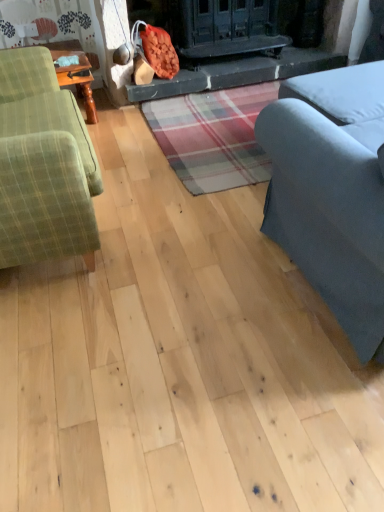
Find the location of a particular element. Image resolution: width=384 pixels, height=512 pixels. green plaid fabric couch at left, the 2th studio couch positioned from the right is located at coordinates coord(43,164).

This screenshot has height=512, width=384. I want to click on smooth stone fireplace at center, so click(237, 72).

Would you consider green plaid fabric couch at left, acting as the first studio couch starting from the left, to be distant from gray fabric couch at right, the 1th studio couch viewed from the right?

No, there isn't a large distance between green plaid fabric couch at left, acting as the first studio couch starting from the left, and gray fabric couch at right, the 1th studio couch viewed from the right.

Considering the sizes of green plaid fabric couch at left, the 2th studio couch positioned from the right, and gray fabric couch at right, the 1th studio couch viewed from the right, in the image, is green plaid fabric couch at left, the 2th studio couch positioned from the right, bigger or smaller than gray fabric couch at right, the 1th studio couch viewed from the right,?

Considering their sizes, green plaid fabric couch at left, the 2th studio couch positioned from the right, takes up less space than gray fabric couch at right, the 1th studio couch viewed from the right.

Which object is more forward, green plaid fabric couch at left, acting as the first studio couch starting from the left, or gray fabric couch at right, the 1th studio couch viewed from the right?

gray fabric couch at right, the 1th studio couch viewed from the right, is closer to the camera.

Between gray fabric couch at right, the 1th studio couch viewed from the right, and green plaid fabric couch at left, the 2th studio couch positioned from the right, which one appears on the left side from the viewer's perspective?

From the viewer's perspective, green plaid fabric couch at left, the 2th studio couch positioned from the right, appears more on the left side.

What's the angular difference between gray fabric couch at right, the 1th studio couch viewed from the right, and green plaid fabric couch at left, acting as the first studio couch starting from the left,'s facing directions?

The facing directions of gray fabric couch at right, the 1th studio couch viewed from the right, and green plaid fabric couch at left, acting as the first studio couch starting from the left, are 88.8 degrees apart.

Based on the photo, is the depth of gray fabric couch at right, marked as the second studio couch in a left-to-right arrangement, less than that of green plaid fabric couch at left, the 2th studio couch positioned from the right?

Yes, gray fabric couch at right, marked as the second studio couch in a left-to-right arrangement, is closer to the viewer.

Consider the image. Who is shorter, smooth stone fireplace at center or gray fabric couch at right, marked as the second studio couch in a left-to-right arrangement?

smooth stone fireplace at center.

Is point (225, 58) behind point (340, 251)?

That is True.

Can you confirm if smooth stone fireplace at center is smaller than gray fabric couch at right, marked as the second studio couch in a left-to-right arrangement?

Yes, smooth stone fireplace at center is smaller than gray fabric couch at right, marked as the second studio couch in a left-to-right arrangement.

Is smooth stone fireplace at center to the right of gray fabric couch at right, the 1th studio couch viewed from the right, from the viewer's perspective?

Incorrect, smooth stone fireplace at center is not on the right side of gray fabric couch at right, the 1th studio couch viewed from the right.

This screenshot has width=384, height=512. Find the location of `fireplace located above the green plaid fabric couch at left, the 2th studio couch positioned from the right (from the image's perspective)`. fireplace located above the green plaid fabric couch at left, the 2th studio couch positioned from the right (from the image's perspective) is located at coordinates (237, 72).

Who is taller, green plaid fabric couch at left, acting as the first studio couch starting from the left, or smooth stone fireplace at center?

Standing taller between the two is green plaid fabric couch at left, acting as the first studio couch starting from the left.

Between point (33, 81) and point (178, 77), which one is positioned behind?

The point (178, 77) is farther.

Is green plaid fabric couch at left, acting as the first studio couch starting from the left, inside the boundaries of smooth stone fireplace at center, or outside?

green plaid fabric couch at left, acting as the first studio couch starting from the left, lies outside smooth stone fireplace at center.

Is point (190, 90) closer to camera compared to point (50, 159)?

No.

What's the angular difference between smooth stone fireplace at center and green plaid fabric couch at left, acting as the first studio couch starting from the left,'s facing directions?

178 degrees separate the facing orientations of smooth stone fireplace at center and green plaid fabric couch at left, acting as the first studio couch starting from the left.

From a real-world perspective, who is located lower, smooth stone fireplace at center or green plaid fabric couch at left, the 2th studio couch positioned from the right?

In real-world perspective, smooth stone fireplace at center is lower.

Between smooth stone fireplace at center and green plaid fabric couch at left, the 2th studio couch positioned from the right, which one has smaller size?

smooth stone fireplace at center.

What's the angular difference between gray fabric couch at right, the 1th studio couch viewed from the right, and smooth stone fireplace at center's facing directions?

The angle between the facing direction of gray fabric couch at right, the 1th studio couch viewed from the right, and the facing direction of smooth stone fireplace at center is 89.5 degrees.

Can you confirm if gray fabric couch at right, the 1th studio couch viewed from the right, is positioned to the right of smooth stone fireplace at center?

Indeed, gray fabric couch at right, the 1th studio couch viewed from the right, is positioned on the right side of smooth stone fireplace at center.

Who is smaller, gray fabric couch at right, marked as the second studio couch in a left-to-right arrangement, or smooth stone fireplace at center?

smooth stone fireplace at center.

Which is in front, point (346, 281) or point (284, 75)?

Positioned in front is point (346, 281).

This screenshot has width=384, height=512. Identify the location of studio couch above the green plaid fabric couch at left, acting as the first studio couch starting from the left (from a real-world perspective). [x=331, y=192].

Where is `studio couch on the right of green plaid fabric couch at left, the 2th studio couch positioned from the right`? The height and width of the screenshot is (512, 384). studio couch on the right of green plaid fabric couch at left, the 2th studio couch positioned from the right is located at coordinates (331, 192).

Estimate the real-world distances between objects in this image. Which object is further from smooth stone fireplace at center, gray fabric couch at right, the 1th studio couch viewed from the right, or green plaid fabric couch at left, the 2th studio couch positioned from the right?

Based on the image, gray fabric couch at right, the 1th studio couch viewed from the right, appears to be further to smooth stone fireplace at center.

Based on their spatial positions, is green plaid fabric couch at left, acting as the first studio couch starting from the left, or smooth stone fireplace at center closer to gray fabric couch at right, the 1th studio couch viewed from the right?

green plaid fabric couch at left, acting as the first studio couch starting from the left.

Which object lies nearer to the anchor point gray fabric couch at right, the 1th studio couch viewed from the right, smooth stone fireplace at center or green plaid fabric couch at left, the 2th studio couch positioned from the right?

green plaid fabric couch at left, the 2th studio couch positioned from the right.

Considering their positions, is smooth stone fireplace at center positioned further to green plaid fabric couch at left, acting as the first studio couch starting from the left, than gray fabric couch at right, the 1th studio couch viewed from the right?

The object further to green plaid fabric couch at left, acting as the first studio couch starting from the left, is smooth stone fireplace at center.

Which object lies nearer to the anchor point green plaid fabric couch at left, the 2th studio couch positioned from the right, gray fabric couch at right, the 1th studio couch viewed from the right, or smooth stone fireplace at center?

gray fabric couch at right, the 1th studio couch viewed from the right, lies closer to green plaid fabric couch at left, the 2th studio couch positioned from the right, than the other object.

Which object lies nearer to the anchor point smooth stone fireplace at center, green plaid fabric couch at left, the 2th studio couch positioned from the right, or gray fabric couch at right, the 1th studio couch viewed from the right?

green plaid fabric couch at left, the 2th studio couch positioned from the right.

Where is `studio couch between gray fabric couch at right, the 1th studio couch viewed from the right, and smooth stone fireplace at center, along the z-axis`? studio couch between gray fabric couch at right, the 1th studio couch viewed from the right, and smooth stone fireplace at center, along the z-axis is located at coordinates (43, 164).